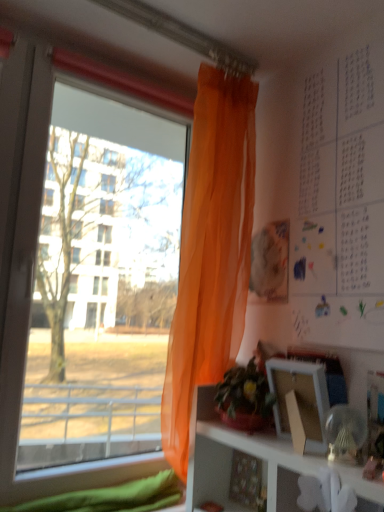
Find the location of a particular element. white paper at upper right is located at coordinates (339, 202).

In order to face white paper at upper right, should I rotate leftwards or rightwards?

It's best to rotate right around 18.953 degrees.

The image size is (384, 512). Describe the element at coordinates (211, 251) in the screenshot. I see `translucent orange curtain at left` at that location.

What is the approximate width of translucent orange curtain at left?

translucent orange curtain at left is 7.44 inches wide.

Measure the distance between white matte picture frame at lower right and camera.

white matte picture frame at lower right and camera are 3.30 feet apart.

Image resolution: width=384 pixels, height=512 pixels. I want to click on green leafy plant at center, so click(x=244, y=398).

This screenshot has width=384, height=512. In order to click on white paper at upper right in this screenshot , I will do `click(339, 202)`.

From a real-world perspective, is white paper at upper right positioned over transparent orange curtain at left based on gravity?

Indeed, from a real-world perspective, white paper at upper right stands above transparent orange curtain at left.

Is white paper at upper right not near transparent orange curtain at left?

No, white paper at upper right is not far from transparent orange curtain at left.

Considering the positions of point (316, 276) and point (48, 482), is point (316, 276) closer or farther from the camera than point (48, 482)?

Clearly, point (316, 276) is more distant from the camera than point (48, 482).

Where is `bulletin board above the transparent orange curtain at left (from the image's perspective)`? bulletin board above the transparent orange curtain at left (from the image's perspective) is located at coordinates (339, 202).

Which of these two, transparent orange curtain at left or green leafy plant at center, stands shorter?

green leafy plant at center.

Between point (49, 414) and point (222, 400), which one is positioned in front?

The point (222, 400) is closer.

In the scene shown: From the image's perspective, is transparent orange curtain at left located above or below green leafy plant at center?

Based on their image positions, transparent orange curtain at left is located above green leafy plant at center.

Is transparent orange curtain at left positioned far away from green leafy plant at center?

transparent orange curtain at left is actually quite close to green leafy plant at center.

From the image's perspective, is green leafy plant at center on top of white paper at upper right?

No, from the image's perspective, green leafy plant at center is not above white paper at upper right.

Is green leafy plant at center looking in the opposite direction of white paper at upper right?

No, green leafy plant at center is not facing the opposite direction of white paper at upper right.

Considering the sizes of objects green leafy plant at center and white paper at upper right in the image provided, who is shorter, green leafy plant at center or white paper at upper right?

green leafy plant at center.

From the picture: How different are the orientations of white matte picture frame at lower right and white paper at upper right in degrees?

white matte picture frame at lower right and white paper at upper right are facing 5.61 degrees away from each other.

Is white matte picture frame at lower right touching white paper at upper right?

No, white matte picture frame at lower right is not next to white paper at upper right.

Does white matte picture frame at lower right appear on the right side of white paper at upper right?

No.

In the scene shown: From a real-world perspective, does white matte picture frame at lower right stand above white paper at upper right?

No, from a real-world perspective, white matte picture frame at lower right is not above white paper at upper right.

Could translucent orange curtain at left be considered to be inside white paper at upper right?

Definitely not — translucent orange curtain at left is not inside white paper at upper right.

Considering the relative sizes of white paper at upper right and translucent orange curtain at left in the image provided, is white paper at upper right wider than translucent orange curtain at left?

In fact, white paper at upper right might be narrower than translucent orange curtain at left.

Looking at this image, considering the sizes of white matte picture frame at lower right and green leafy plant at center in the image, is white matte picture frame at lower right bigger or smaller than green leafy plant at center?

white matte picture frame at lower right is smaller than green leafy plant at center.

Which object is further away from the camera taking this photo, white matte picture frame at lower right or green leafy plant at center?

green leafy plant at center is more distant.

From a real-world perspective, relative to green leafy plant at center, is white matte picture frame at lower right vertically above or below?

white matte picture frame at lower right is situated higher than green leafy plant at center in the real world.

Are white matte picture frame at lower right and green leafy plant at center beside each other?

Yes, white matte picture frame at lower right is with green leafy plant at center.

Consider the image. Is the surface of translucent orange curtain at left in direct contact with white paper at upper right?

There is a gap between translucent orange curtain at left and white paper at upper right.

Looking at this image, is translucent orange curtain at left facing towards white paper at upper right?

Yes, translucent orange curtain at left is facing white paper at upper right.

From a real-world perspective, between translucent orange curtain at left and white paper at upper right, who is vertically lower?

translucent orange curtain at left, from a real-world perspective.

Considering the sizes of translucent orange curtain at left and white paper at upper right in the image, is translucent orange curtain at left wider or thinner than white paper at upper right?

translucent orange curtain at left is wider than white paper at upper right.

I want to click on window in front of the white paper at upper right, so [x=83, y=278].

The image size is (384, 512). I want to click on houseplant lying behind the transparent orange curtain at left, so click(244, 398).

Based on the photo, estimate the real-world distances between objects in this image. Which object is further from white matte picture frame at lower right, white paper at upper right or transparent orange curtain at left?

transparent orange curtain at left lies further to white matte picture frame at lower right than the other object.

Based on their spatial positions, is white matte picture frame at lower right or transparent orange curtain at left further from translucent orange curtain at left?

transparent orange curtain at left is positioned further to the anchor translucent orange curtain at left.

Based on their spatial positions, is translucent orange curtain at left or white matte picture frame at lower right further from white paper at upper right?

white matte picture frame at lower right is further to white paper at upper right.

Considering their positions, is transparent orange curtain at left positioned further to green leafy plant at center than white paper at upper right?

Based on the image, transparent orange curtain at left appears to be further to green leafy plant at center.

Estimate the real-world distances between objects in this image. Which object is further from white matte picture frame at lower right, green leafy plant at center or white paper at upper right?

Among the two, white paper at upper right is located further to white matte picture frame at lower right.

Estimate the real-world distances between objects in this image. Which object is further from white matte picture frame at lower right, transparent orange curtain at left or white paper at upper right?

transparent orange curtain at left.

When comparing their distances from white paper at upper right, does white matte picture frame at lower right or green leafy plant at center seem further?

green leafy plant at center is positioned further to the anchor white paper at upper right.

Looking at the image, which one is located closer to white matte picture frame at lower right, translucent orange curtain at left or white paper at upper right?

white paper at upper right is closer to white matte picture frame at lower right.

At what (x,y) coordinates should I click in order to perform the action: click on houseplant located between transparent orange curtain at left and white matte picture frame at lower right in the left-right direction. Please return your answer as a coordinate pair (x, y). This screenshot has height=512, width=384. Looking at the image, I should click on (244, 398).

Locate an element on the screen. The image size is (384, 512). houseplant located between transparent orange curtain at left and white paper at upper right in the left-right direction is located at coordinates (244, 398).

Where is `picture frame situated between transparent orange curtain at left and white paper at upper right from left to right`? picture frame situated between transparent orange curtain at left and white paper at upper right from left to right is located at coordinates (299, 403).

At what (x,y) coordinates should I click in order to perform the action: click on picture frame between white paper at upper right and green leafy plant at center in the up-down direction. Please return your answer as a coordinate pair (x, y). Looking at the image, I should click on (299, 403).